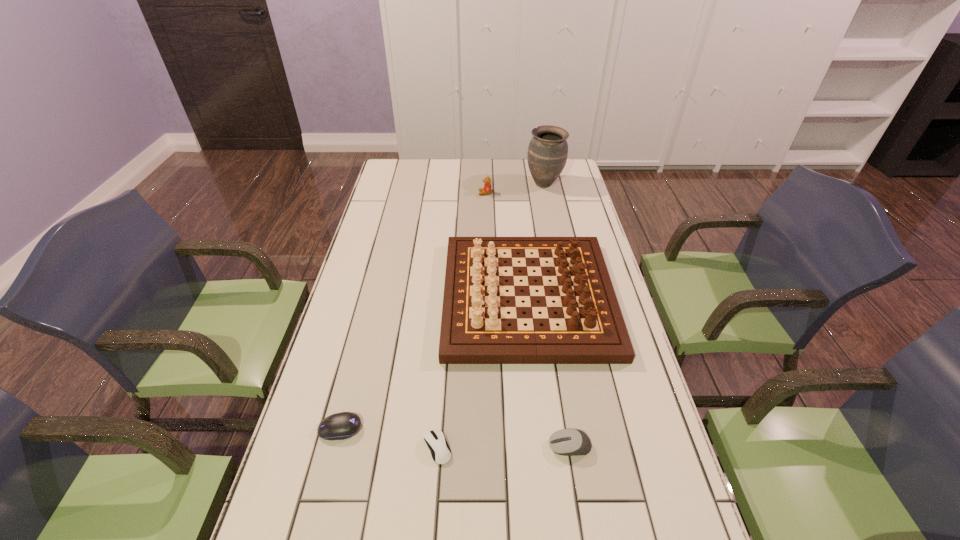
Where is `vacant position located 0.080m on the side with the white pieces of the gameboard`? The width and height of the screenshot is (960, 540). vacant position located 0.080m on the side with the white pieces of the gameboard is located at coordinates (420, 297).

The height and width of the screenshot is (540, 960). What are the coordinates of `vacant space located on the front-facing side of the teddy bear` in the screenshot? It's located at (457, 193).

Where is `free spot located on the front-facing side of the teddy bear`? The height and width of the screenshot is (540, 960). free spot located on the front-facing side of the teddy bear is located at coordinates (395, 193).

Identify the location of vacant space situated 0.390m on the front-facing side of the teddy bear. (387, 193).

Locate an element on the screen. The width and height of the screenshot is (960, 540). vacant area situated on the wheel side of the rightmost mouse is located at coordinates (421, 447).

You are a GUI agent. You are given a task and a screenshot of the screen. Output one action in this format:
    pyautogui.click(x=<x>, y=<y>)
    Task: Click on the vacant space located 0.150m on the wheel side of the rightmost mouse
    This screenshot has height=540, width=960.
    Given the screenshot: What is the action you would take?
    pyautogui.click(x=485, y=447)

The width and height of the screenshot is (960, 540). In order to click on vacant space located 0.380m on the wheel side of the rightmost mouse in this screenshot , I will do `click(388, 447)`.

I want to click on vacant position located 0.310m on the back of the leftmost mouse, so click(367, 323).

Locate an element on the screen. The width and height of the screenshot is (960, 540). free location located 0.230m on the left of the second mouse from right to left is located at coordinates (326, 448).

In order to click on object at the far edge in this screenshot , I will do (x=547, y=154).